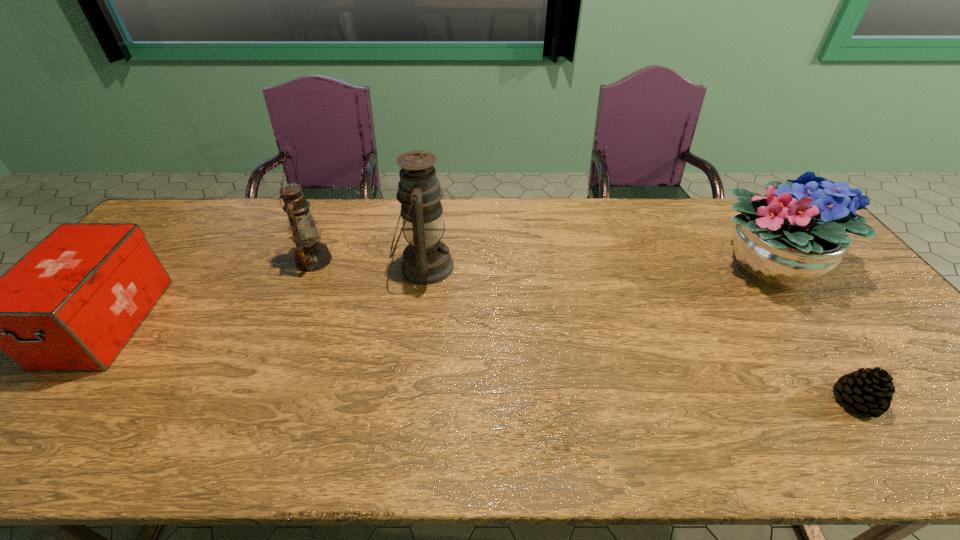
Image resolution: width=960 pixels, height=540 pixels. In the image, there is a desktop. Identify the location of vacant space at the near edge. (138, 451).

You are a GUI agent. You are given a task and a screenshot of the screen. Output one action in this format:
    pyautogui.click(x=<x>, y=<y>)
    Task: Click on the vacant space at the right edge
    
    Given the screenshot: What is the action you would take?
    pyautogui.click(x=874, y=315)

You are a GUI agent. You are given a task and a screenshot of the screen. Output one action in this format:
    pyautogui.click(x=<x>, y=<y>)
    Task: Click on the vacant space at the near left corner of the desktop
    The height and width of the screenshot is (540, 960).
    Given the screenshot: What is the action you would take?
    pyautogui.click(x=2, y=437)

At what (x,y) coordinates should I click in order to perform the action: click on vacant space that is in between the third object from left to right and the fourth tallest object. Please return your answer as a coordinate pair (x, y). Image resolution: width=960 pixels, height=540 pixels. Looking at the image, I should click on (265, 294).

You are a GUI agent. You are given a task and a screenshot of the screen. Output one action in this format:
    pyautogui.click(x=<x>, y=<y>)
    Task: Click on the empty location between the left oil lamp and the nearest object
    The width and height of the screenshot is (960, 540).
    Given the screenshot: What is the action you would take?
    pyautogui.click(x=585, y=330)

Locate an element on the screen. This screenshot has width=960, height=540. vacant point located between the leftmost object and the third shortest object is located at coordinates (437, 294).

This screenshot has height=540, width=960. I want to click on unoccupied area between the bouquet and the second object from left to right, so click(540, 264).

The height and width of the screenshot is (540, 960). What are the coordinates of `vacant space that is in between the bouquet and the left oil lamp` in the screenshot? It's located at (540, 264).

Where is `blank region between the third shortest object and the left oil lamp`? blank region between the third shortest object and the left oil lamp is located at coordinates (540, 264).

This screenshot has height=540, width=960. Find the location of `empty space that is in between the third shortest object and the left oil lamp`. empty space that is in between the third shortest object and the left oil lamp is located at coordinates (540, 264).